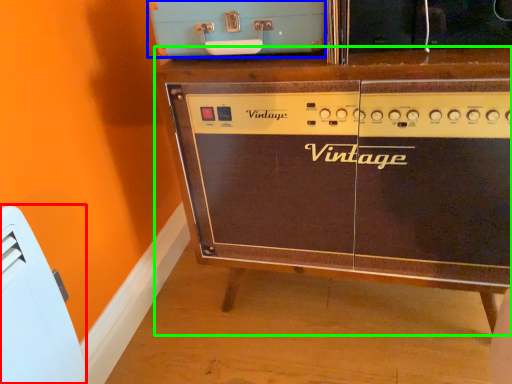
Question: Which is nearer to the appliance (highlighted by a red box)? appliance (highlighted by a blue box) or furniture (highlighted by a green box).

Choices:
 (A) appliance
 (B) furniture

Answer: (A)